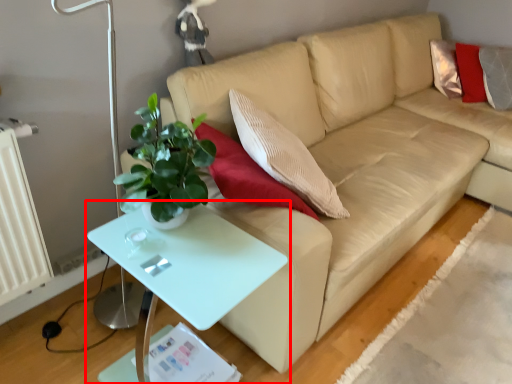
Question: From the image, what is the correct spatial relationship of table (annotated by the red box) in relation to studio couch?

Choices:
 (A) right
 (B) left

Answer: (B)